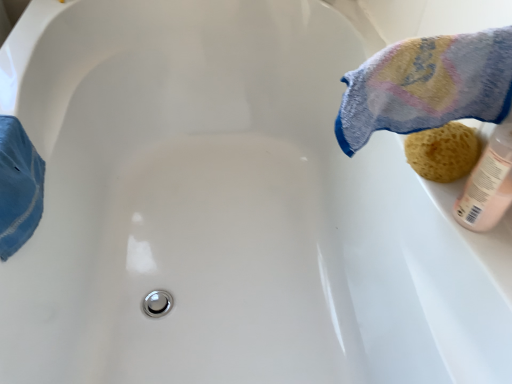
Question: Would you say yellow sponge at right is to the left or to the right of multicolored terry cloth towel at upper right in the picture?

Choices:
 (A) right
 (B) left

Answer: (A)

Question: From the image's perspective, relative to multicolored terry cloth towel at upper right, is yellow sponge at right above or below?

Choices:
 (A) below
 (B) above

Answer: (A)

Question: Is yellow sponge at right taller or shorter than multicolored terry cloth towel at upper right?

Choices:
 (A) short
 (B) tall

Answer: (A)

Question: Looking at the image, does multicolored terry cloth towel at upper right seem bigger or smaller compared to yellow sponge at right?

Choices:
 (A) big
 (B) small

Answer: (A)

Question: From the image's perspective, is multicolored terry cloth towel at upper right located above or below yellow sponge at right?

Choices:
 (A) below
 (B) above

Answer: (B)

Question: From a real-world perspective, relative to yellow sponge at right, is multicolored terry cloth towel at upper right vertically above or below?

Choices:
 (A) below
 (B) above

Answer: (B)

Question: Is multicolored terry cloth towel at upper right spatially inside yellow sponge at right, or outside of it?

Choices:
 (A) inside
 (B) outside

Answer: (B)